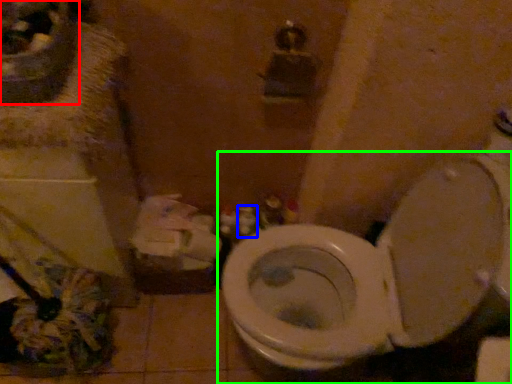
Question: Based on their relative distances, which object is nearer to sink (highlighted by a red box)? Choose from toiletry (highlighted by a blue box) and toilet (highlighted by a green box).

Choices:
 (A) toiletry
 (B) toilet

Answer: (B)